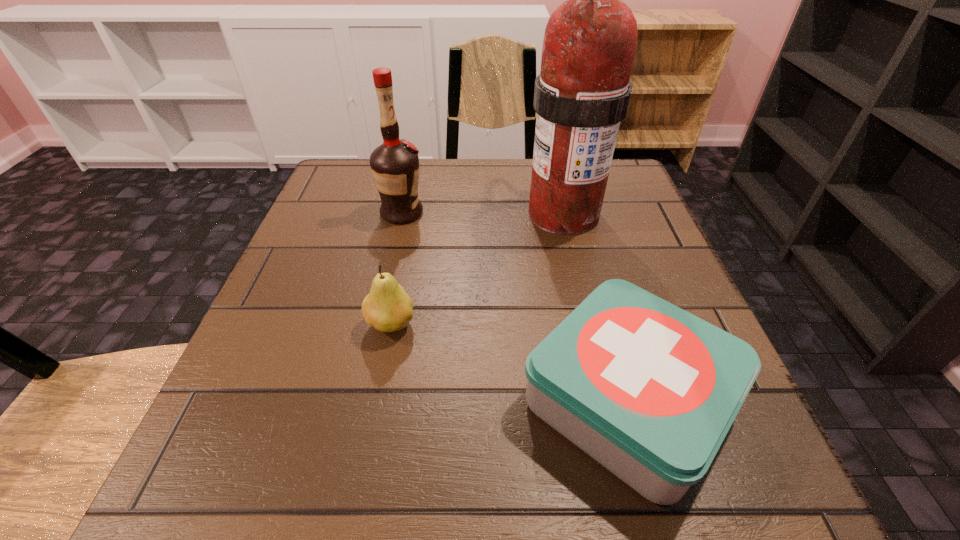
At what (x,y) coordinates should I click in order to perform the action: click on object at the near edge. Please return your answer as a coordinate pair (x, y). The width and height of the screenshot is (960, 540). Looking at the image, I should click on (648, 390).

Find the location of a particular element. This screenshot has height=540, width=960. object that is at the left edge is located at coordinates (394, 164).

Where is `fire extinguisher that is at the right edge`? fire extinguisher that is at the right edge is located at coordinates (582, 94).

Identify the location of the first-aid kit located in the right edge section of the desktop. The height and width of the screenshot is (540, 960). (648, 390).

The image size is (960, 540). Find the location of `object that is at the far left corner`. object that is at the far left corner is located at coordinates (394, 164).

Locate an element on the screen. object at the far right corner is located at coordinates (582, 94).

What are the coordinates of `object at the near right corner` in the screenshot? It's located at (648, 390).

You are a GUI agent. You are given a task and a screenshot of the screen. Output one action in this format:
    pyautogui.click(x=<x>, y=<y>)
    Task: Click on the vacant region at the far edge of the desktop
    
    Given the screenshot: What is the action you would take?
    pyautogui.click(x=438, y=175)

Identify the location of vacant space at the near edge. This screenshot has width=960, height=540. (416, 457).

The image size is (960, 540). I want to click on free location at the left edge of the desktop, so click(273, 319).